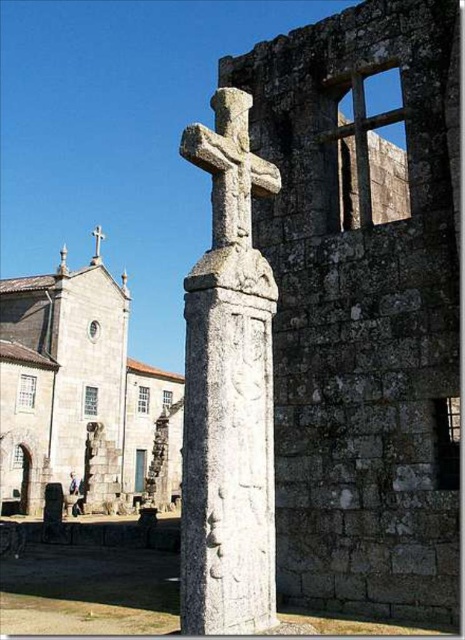
Question: Which point is farther to the camera?

Choices:
 (A) gray stone cross at center
 (B) white stone cross at center
 (C) gray stone church at center

Answer: (B)

Question: Where is gray stone cross at center located in relation to gray stone church at center in the image?

Choices:
 (A) left
 (B) right

Answer: (B)

Question: Which of the following is the farthest from the observer?

Choices:
 (A) white stone cross at center
 (B) gray stone cross at center
 (C) gray stone church at center

Answer: (A)

Question: Can you confirm if gray stone cross at center is positioned to the right of gray stone church at center?

Choices:
 (A) yes
 (B) no

Answer: (A)

Question: Is the position of gray stone cross at center more distant than that of white stone cross at center?

Choices:
 (A) yes
 (B) no

Answer: (B)

Question: Which is farther from the gray stone church at center?

Choices:
 (A) white stone cross at center
 (B) gray stone cross at center

Answer: (B)